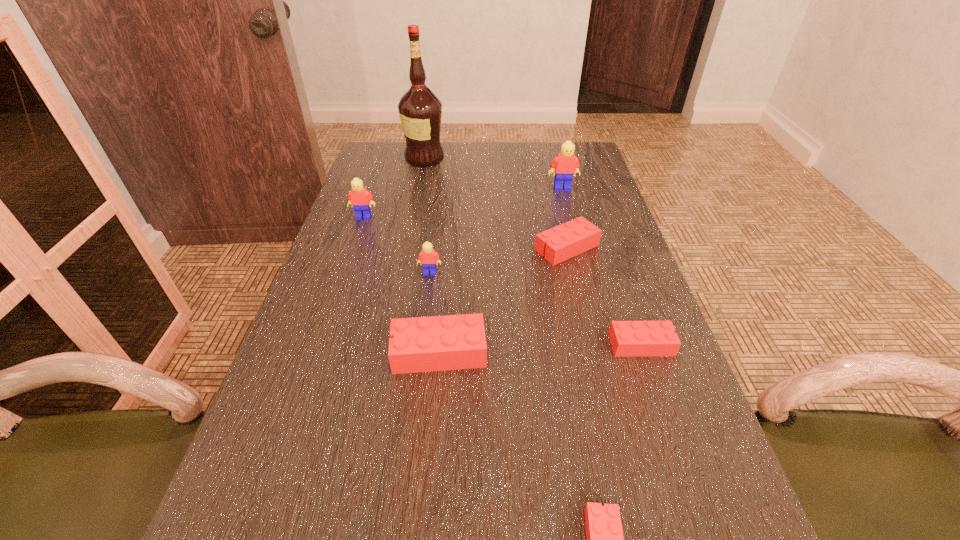
At what (x,y) coordinates should I click in order to perform the action: click on the farthest object. Please return your answer as a coordinate pair (x, y). The width and height of the screenshot is (960, 540). Looking at the image, I should click on (420, 110).

I want to click on brown alcohol, so click(x=420, y=110).

In order to click on the seventh nearest object in this screenshot , I will do `click(565, 164)`.

Image resolution: width=960 pixels, height=540 pixels. I want to click on the farthest yellow Lego, so click(x=565, y=164).

Locate an element on the screen. The image size is (960, 540). the leftmost object is located at coordinates (358, 197).

At what (x,y) coordinates should I click in order to perform the action: click on the leftmost Lego. Please return your answer as a coordinate pair (x, y). Looking at the image, I should click on (358, 197).

At what (x,y) coordinates should I click in order to perform the action: click on the nearest yellow Lego. Please return your answer as a coordinate pair (x, y). Looking at the image, I should click on (428, 256).

You are a GUI agent. You are given a task and a screenshot of the screen. Output one action in this format:
    pyautogui.click(x=<x>, y=<y>)
    Task: Click on the second yellow Lego from right to left
    This screenshot has height=540, width=960.
    Given the screenshot: What is the action you would take?
    pyautogui.click(x=428, y=256)

Find the location of a particular element. the leftmost red Lego is located at coordinates (437, 343).

At what (x,y) coordinates should I click in order to perform the action: click on the fourth shortest Lego. Please return your answer as a coordinate pair (x, y). Looking at the image, I should click on (437, 343).